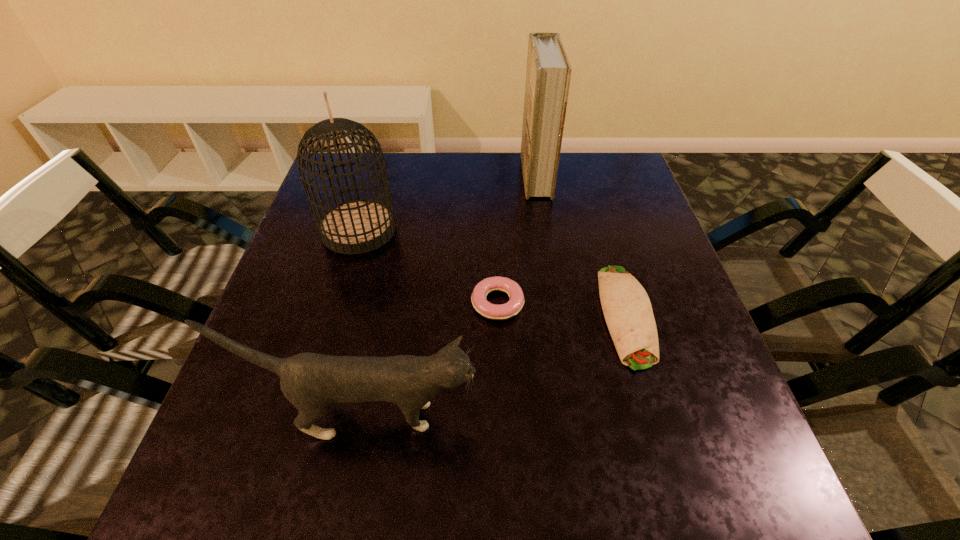
This screenshot has height=540, width=960. I want to click on vacant space that is in between the birdcage and the phonebook, so [447, 203].

The height and width of the screenshot is (540, 960). Find the location of `free space between the second farthest object and the burrito`. free space between the second farthest object and the burrito is located at coordinates (492, 272).

The width and height of the screenshot is (960, 540). I want to click on unoccupied area between the nearest object and the birdcage, so click(x=362, y=323).

Point out which object is positioned as the fourth nearest to the birdcage. Please provide its 2D coordinates. Your answer should be formatted as a tuple, i.e. [(x, y)], where the tuple contains the x and y coordinates of a point satisfying the conditions above.

[(627, 309)]

Find the location of a particular element. The image size is (960, 540). object that ranks as the second closest to the nearest object is located at coordinates (627, 309).

Identify the location of vacant space that satisfies the following two spatial constraints: 1. on the front side of the birdcage; 2. on the left side of the doughnut. This screenshot has width=960, height=540. (337, 303).

Locate an element on the screen. The height and width of the screenshot is (540, 960). vacant space that satisfies the following two spatial constraints: 1. at the bitten end of the burrito; 2. at the face of the third shortest object is located at coordinates (656, 416).